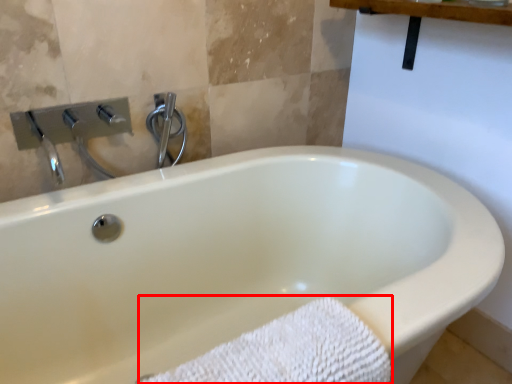
Question: From the image's perspective, where is bath towel (annotated by the red box) located relative to shower?

Choices:
 (A) below
 (B) above

Answer: (A)